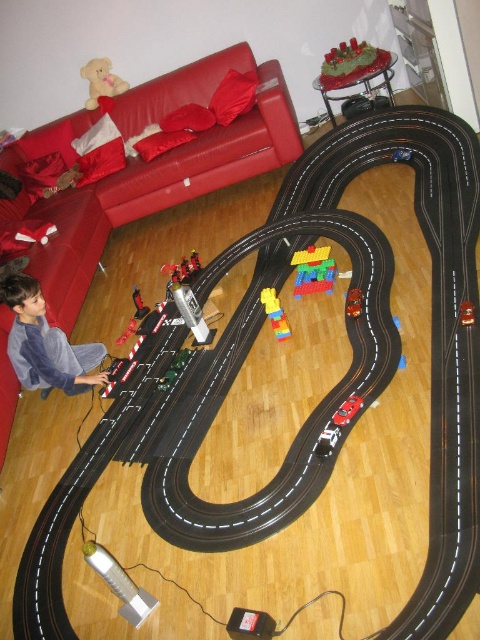
You are a parent trying to decide which car to give to your 3 year old. The metallic silver car at center and the metallic silver remote control car at lower left are both available. Based on their sizes, which one is more appropriate for a young child?

The metallic silver car at center is smaller than the metallic silver remote control car at lower left, so the metallic silver car at center is more appropriate for a young child as it is smaller and easier to handle.

You are a child trying to reach the slot car track. You are standing at point (x=134, y=321). There is a path to the track that goes through point (x=50, y=342). Will you have to move forward or backward to reach the track from your current position?

Since point (x=50, y=342) is in front of point (x=134, y=321), you will have to move forward to reach the track through point (x=50, y=342).